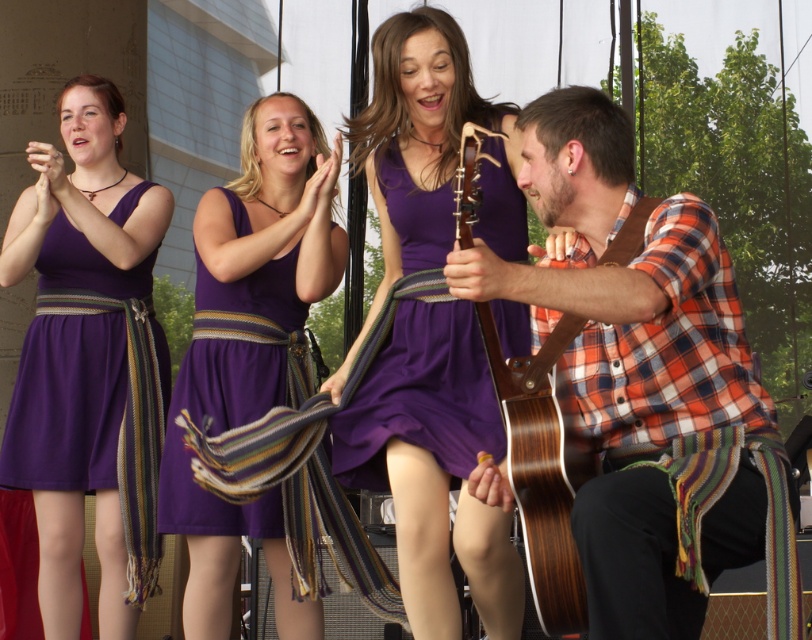
Question: Is purple matte dress at left further to the viewer compared to purple satin dress at center?

Choices:
 (A) yes
 (B) no

Answer: (A)

Question: Which object is closer to the camera taking this photo?

Choices:
 (A) wooden acoustic guitar at right
 (B) purple satin dress at center

Answer: (A)

Question: Estimate the real-world distances between objects in this image. Which object is closer to the wooden acoustic guitar at right?

Choices:
 (A) plaid shirt at right
 (B) purple satin dress at center
 (C) purple matte dress at center

Answer: (A)

Question: Can you confirm if purple matte dress at left is smaller than purple satin dress at center?

Choices:
 (A) no
 (B) yes

Answer: (A)

Question: Considering the relative positions of purple satin dress at center and wooden acoustic guitar at right in the image provided, where is purple satin dress at center located with respect to wooden acoustic guitar at right?

Choices:
 (A) below
 (B) above

Answer: (B)

Question: Based on their relative distances, which object is nearer to the purple matte dress at left?

Choices:
 (A) plaid shirt at right
 (B) purple satin dress at center
 (C) purple matte dress at center
 (D) wooden acoustic guitar at right

Answer: (C)